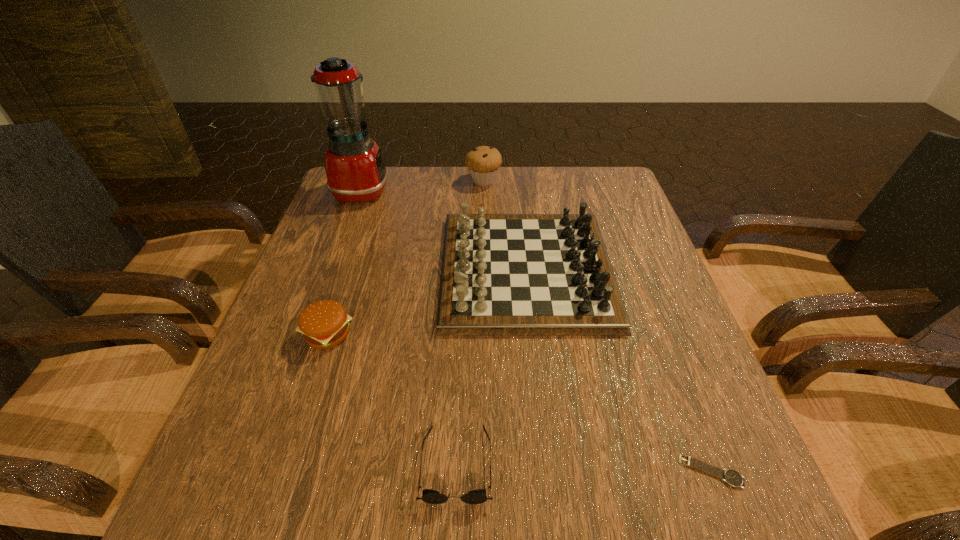
I want to click on blank area located from the player's perspective of the chessboard, so click(317, 270).

Find the location of `free spot located from the player's perspective of the chessboard`. free spot located from the player's perspective of the chessboard is located at coordinates (304, 270).

Find the location of a particular element. vacant point located 0.080m on the right of the hamburger is located at coordinates (393, 334).

Image resolution: width=960 pixels, height=540 pixels. In order to click on vacant area situated on the back of the watch in this screenshot , I will do `click(651, 315)`.

This screenshot has height=540, width=960. What are the coordinates of `food processor located at the far edge` in the screenshot? It's located at (355, 170).

The width and height of the screenshot is (960, 540). I want to click on muffin at the far edge, so click(483, 162).

Find the location of a particular element. The width and height of the screenshot is (960, 540). sunglasses situated at the near edge is located at coordinates (478, 496).

Locate an element on the screen. The image size is (960, 540). watch present at the near edge is located at coordinates coord(730,476).

Where is `food processor that is at the left edge`? food processor that is at the left edge is located at coordinates (355, 170).

The image size is (960, 540). In order to click on hamburger located in the left edge section of the desktop in this screenshot , I will do `click(324, 324)`.